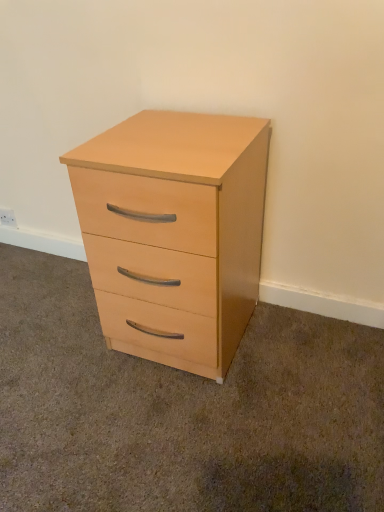
Question: From the image's perspective, relative to light wood/finish chest of drawers at center, is white plastic electric outlet at lower left above or below?

Choices:
 (A) above
 (B) below

Answer: (A)

Question: Looking at their shapes, would you say white plastic electric outlet at lower left is wider or thinner than light wood/finish chest of drawers at center?

Choices:
 (A) wide
 (B) thin

Answer: (B)

Question: Considering the positions of white plastic electric outlet at lower left and light wood/finish chest of drawers at center in the image, is white plastic electric outlet at lower left bigger or smaller than light wood/finish chest of drawers at center?

Choices:
 (A) small
 (B) big

Answer: (A)

Question: In terms of size, does light wood/finish chest of drawers at center appear bigger or smaller than white plastic electric outlet at lower left?

Choices:
 (A) small
 (B) big

Answer: (B)

Question: From a real-world perspective, relative to white plastic electric outlet at lower left, is light wood/finish chest of drawers at center vertically above or below?

Choices:
 (A) above
 (B) below

Answer: (A)

Question: In terms of height, does light wood/finish chest of drawers at center look taller or shorter compared to white plastic electric outlet at lower left?

Choices:
 (A) tall
 (B) short

Answer: (A)

Question: Considering the positions of point (246, 278) and point (11, 221), is point (246, 278) closer or farther from the camera than point (11, 221)?

Choices:
 (A) closer
 (B) farther

Answer: (A)